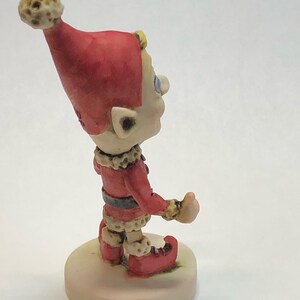
At what (x,y) coordinates should I click in order to perform the action: click on podium. Please return your answer as a coordinate pair (x, y). The image size is (300, 300). Looking at the image, I should click on (141, 289).